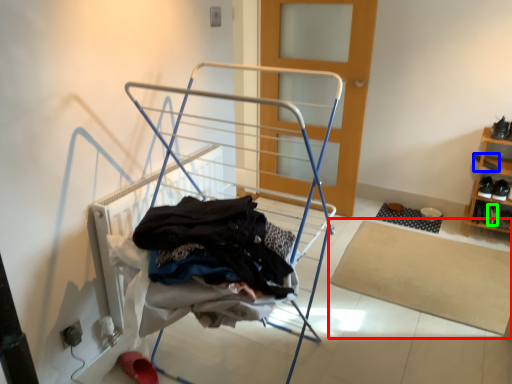
Question: Which is farther away from mat (highlighted by a red box)? shoe (highlighted by a blue box) or shoe (highlighted by a green box)?

Choices:
 (A) shoe
 (B) shoe

Answer: (A)